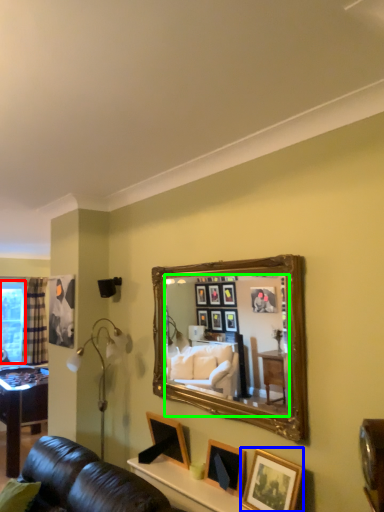
Question: Considering the real-world distances, which object is farthest from window screen (highlighted by a red box)? picture frame (highlighted by a blue box) or mirror (highlighted by a green box)?

Choices:
 (A) picture frame
 (B) mirror

Answer: (A)